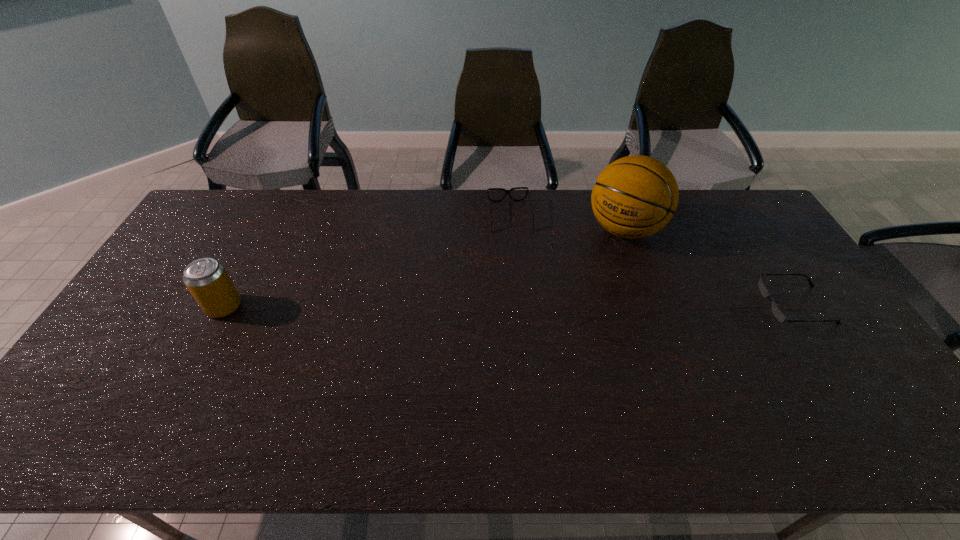
At what (x,y) coordinates should I click in order to perform the action: click on free space that satisfies the following two spatial constraints: 1. on the back side of the second tallest object; 2. on the front-facing side of the rightmost object. Please return your answer as a coordinate pair (x, y). Looking at the image, I should click on (225, 305).